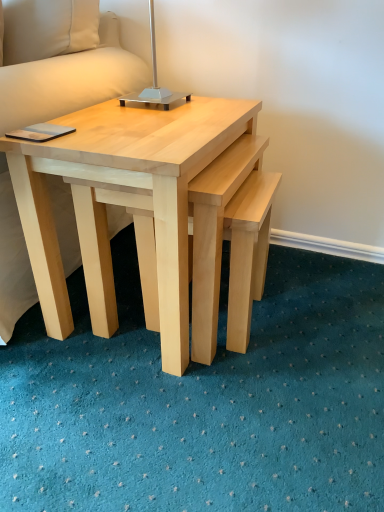
The width and height of the screenshot is (384, 512). What are the coordinates of `metallic silver table lamp at upper center` in the screenshot? It's located at (154, 79).

Describe the element at coordinates (48, 28) in the screenshot. Image resolution: width=384 pixels, height=512 pixels. I see `white fabric pillow at upper left` at that location.

Find the location of a particular element. The height and width of the screenshot is (512, 384). metallic silver table lamp at upper center is located at coordinates (154, 79).

Would you say metallic silver table lamp at upper center contains natural wood coffee table at center?

Actually, natural wood coffee table at center is outside metallic silver table lamp at upper center.

From a real-world perspective, relative to natural wood coffee table at center, is metallic silver table lamp at upper center vertically above or below?

metallic silver table lamp at upper center is above natural wood coffee table at center.

Could you tell me if metallic silver table lamp at upper center is facing natural wood coffee table at center?

No, metallic silver table lamp at upper center is not turned towards natural wood coffee table at center.

In the scene shown: Is metallic silver table lamp at upper center to the left or to the right of natural wood coffee table at center in the image?

From the image, it's evident that metallic silver table lamp at upper center is to the left of natural wood coffee table at center.

Is natural wood coffee table at center to the right of white fabric pillow at upper left from the viewer's perspective?

Yes, natural wood coffee table at center is to the right of white fabric pillow at upper left.

Where is `coffee table in front of the white fabric pillow at upper left`? The width and height of the screenshot is (384, 512). coffee table in front of the white fabric pillow at upper left is located at coordinates (125, 185).

Which of these two, natural wood coffee table at center or white fabric pillow at upper left, is thinner?

white fabric pillow at upper left is thinner.

Is natural wood coffee table at center positioned with its back to white fabric pillow at upper left?

natural wood coffee table at center does not have its back to white fabric pillow at upper left.

Between white fabric pillow at upper left and metallic silver table lamp at upper center, which one has larger size?

metallic silver table lamp at upper center is bigger.

Is white fabric pillow at upper left at the right side of metallic silver table lamp at upper center?

In fact, white fabric pillow at upper left is to the left of metallic silver table lamp at upper center.

Is white fabric pillow at upper left looking in the opposite direction of metallic silver table lamp at upper center?

That's not correct — white fabric pillow at upper left is not looking away from metallic silver table lamp at upper center.

Is white fabric pillow at upper left further to the viewer compared to metallic silver table lamp at upper center?

Yes, white fabric pillow at upper left is further from the camera.

Considering the positions of objects natural wood coffee table at center and metallic silver table lamp at upper center in the image provided, who is more to the right, natural wood coffee table at center or metallic silver table lamp at upper center?

Positioned to the right is natural wood coffee table at center.

Would you say natural wood coffee table at center is a long distance from metallic silver table lamp at upper center?

Actually, natural wood coffee table at center and metallic silver table lamp at upper center are a little close together.

Considering the positions of point (153, 185) and point (168, 105), is point (153, 185) closer or farther from the camera than point (168, 105)?

Clearly, point (153, 185) is closer to the camera than point (168, 105).

Where is `bedside lamp above the natural wood coffee table at center (from a real-world perspective)`? Image resolution: width=384 pixels, height=512 pixels. bedside lamp above the natural wood coffee table at center (from a real-world perspective) is located at coordinates (154, 79).

In the scene shown: Could you measure the distance between metallic silver table lamp at upper center and white fabric pillow at upper left?

metallic silver table lamp at upper center and white fabric pillow at upper left are 11.72 inches apart from each other.

Can you confirm if metallic silver table lamp at upper center is taller than white fabric pillow at upper left?

Indeed, metallic silver table lamp at upper center has a greater height compared to white fabric pillow at upper left.

Considering the points (153, 2) and (73, 13), which point is in front, point (153, 2) or point (73, 13)?

The point (73, 13) is more forward.

Is metallic silver table lamp at upper center thinner than white fabric pillow at upper left?

In fact, metallic silver table lamp at upper center might be wider than white fabric pillow at upper left.

Based on the photo, measure the distance between white fabric pillow at upper left and natural wood coffee table at center.

They are 20.05 inches apart.

Is white fabric pillow at upper left positioned in front of natural wood coffee table at center?

No, it is behind natural wood coffee table at center.

Locate an element on the screen. This screenshot has width=384, height=512. coffee table below the white fabric pillow at upper left (from the image's perspective) is located at coordinates 125,185.

In the scene shown: Is white fabric pillow at upper left inside the boundaries of natural wood coffee table at center, or outside?

white fabric pillow at upper left is spatially situated outside natural wood coffee table at center.

Find the location of a particular element. This screenshot has height=512, width=384. bedside lamp above the natural wood coffee table at center (from a real-world perspective) is located at coordinates (154, 79).

I want to click on coffee table on the right of white fabric pillow at upper left, so click(x=125, y=185).

From the image, which object appears to be farther from natural wood coffee table at center, metallic silver table lamp at upper center or white fabric pillow at upper left?

white fabric pillow at upper left is positioned further to the anchor natural wood coffee table at center.

Estimate the real-world distances between objects in this image. Which object is closer to natural wood coffee table at center, white fabric pillow at upper left or metallic silver table lamp at upper center?

Based on the image, metallic silver table lamp at upper center appears to be nearer to natural wood coffee table at center.

When comparing their distances from white fabric pillow at upper left, does natural wood coffee table at center or metallic silver table lamp at upper center seem closer?

metallic silver table lamp at upper center.

Which object lies further to the anchor point white fabric pillow at upper left, metallic silver table lamp at upper center or natural wood coffee table at center?

natural wood coffee table at center.

Estimate the real-world distances between objects in this image. Which object is further from metallic silver table lamp at upper center, natural wood coffee table at center or white fabric pillow at upper left?

Among the two, natural wood coffee table at center is located further to metallic silver table lamp at upper center.

Which object lies nearer to the anchor point metallic silver table lamp at upper center, white fabric pillow at upper left or natural wood coffee table at center?

white fabric pillow at upper left.

The image size is (384, 512). Find the location of `bedside lamp between white fabric pillow at upper left and natural wood coffee table at center in the vertical direction`. bedside lamp between white fabric pillow at upper left and natural wood coffee table at center in the vertical direction is located at coordinates (154, 79).